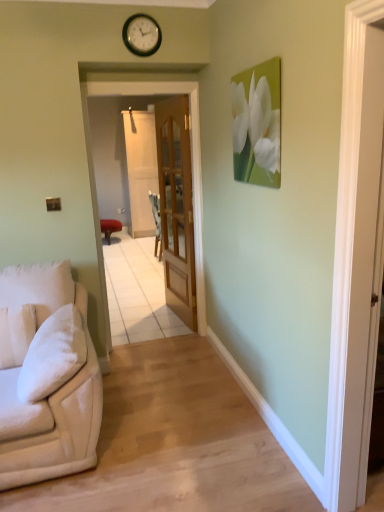
Question: Is white soft pillow at left wider or thinner than metallic gold clock at upper center?

Choices:
 (A) thin
 (B) wide

Answer: (B)

Question: Is white soft pillow at left bigger or smaller than metallic gold clock at upper center?

Choices:
 (A) small
 (B) big

Answer: (B)

Question: Estimate the real-world distances between objects in this image. Which object is closer to the white matte flower at upper right?

Choices:
 (A) white soft pillow at left
 (B) metallic gold clock at upper center
 (C) wooden glass door at center
 (D) matte red stool at center
 (E) beige fabric couch at left

Answer: (B)

Question: Which object is positioned farthest from the beige fabric couch at left?

Choices:
 (A) clear glass door at center, which is the second screen door from back to front
 (B) clear glass screen door at center, marked as the second screen door in a front-to-back arrangement
 (C) white soft pillow at left
 (D) matte red stool at center
 (E) metallic gold clock at upper center

Answer: (B)